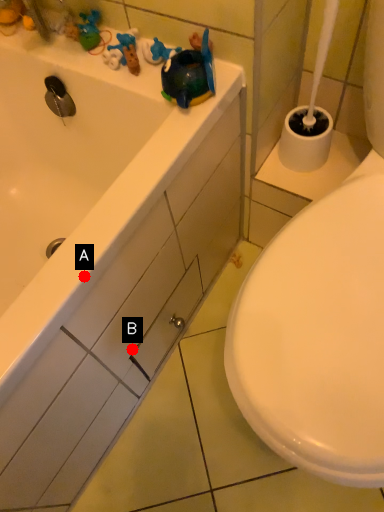
Question: Two points are circled on the image, labeled by A and B beside each circle. Which point is closer to the camera?

Choices:
 (A) A is closer
 (B) B is closer

Answer: (A)